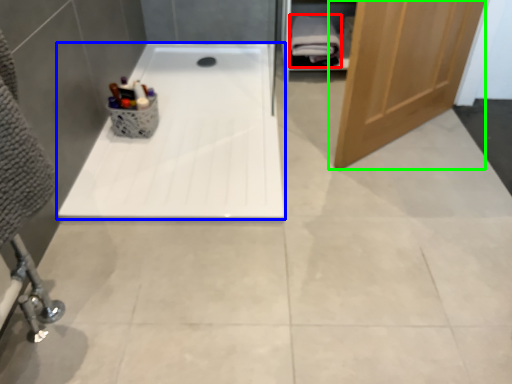
Question: Based on their relative distances, which object is farther from bath towel (highlighted by a red box)? Choose from bathtub (highlighted by a blue box) and door (highlighted by a green box).

Choices:
 (A) bathtub
 (B) door

Answer: (B)